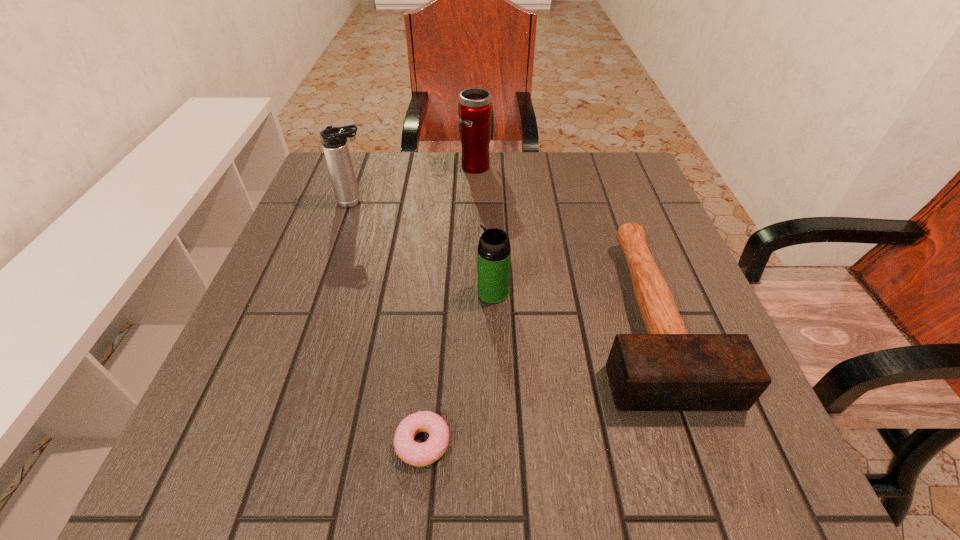
The width and height of the screenshot is (960, 540). I want to click on vacant region located 0.360m from the spout of the nearest thermos bottle, so click(x=294, y=292).

Where is `blank space located 0.300m from the spout of the nearest thermos bottle`? The image size is (960, 540). blank space located 0.300m from the spout of the nearest thermos bottle is located at coordinates (324, 292).

Where is `vacant area situated 0.360m from the spout of the nearest thermos bottle`? The image size is (960, 540). vacant area situated 0.360m from the spout of the nearest thermos bottle is located at coordinates (294, 292).

Locate an element on the screen. The width and height of the screenshot is (960, 540). vacant space located on the hammer head face of the mallet is located at coordinates (698, 457).

Find the location of a particular element. Image resolution: width=960 pixels, height=540 pixels. free point located 0.300m on the right of the doughnut is located at coordinates (653, 443).

Identify the location of object that is at the near edge. This screenshot has height=540, width=960. (417, 454).

This screenshot has width=960, height=540. Identify the location of object at the left edge. (334, 140).

Where is `object present at the right edge`? This screenshot has height=540, width=960. object present at the right edge is located at coordinates (667, 369).

Where is `object that is positioned at the far left corner`? The image size is (960, 540). object that is positioned at the far left corner is located at coordinates (334, 140).

Locate an element on the screen. The width and height of the screenshot is (960, 540). vacant space at the far edge of the desktop is located at coordinates point(570,202).